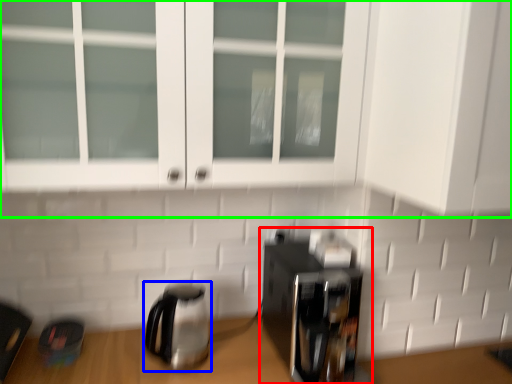
Question: Which object is the farthest from coffee maker (highlighted by a red box)? Choose among these: kettle (highlighted by a blue box) or cabinetry (highlighted by a green box).

Choices:
 (A) kettle
 (B) cabinetry

Answer: (B)